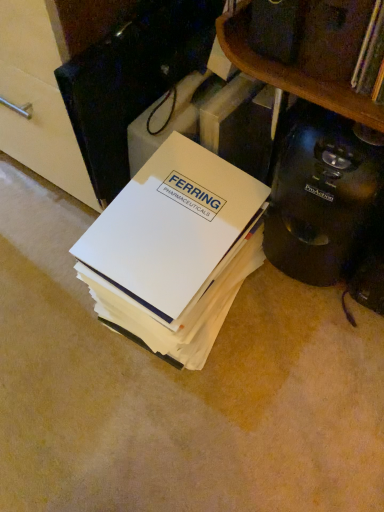
The height and width of the screenshot is (512, 384). Find the location of `vacant space situated on the left part of white paper at center`. vacant space situated on the left part of white paper at center is located at coordinates [x=45, y=302].